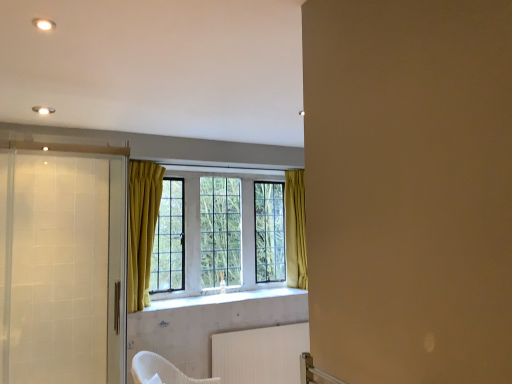
Question: Considering the relative positions of white textured radiator at lower center and white textured tile at center in the image provided, is white textured radiator at lower center to the left or to the right of white textured tile at center?

Choices:
 (A) left
 (B) right

Answer: (B)

Question: Relative to white textured tile at center, is white textured radiator at lower center in front or behind?

Choices:
 (A) behind
 (B) front

Answer: (A)

Question: Estimate the real-world distances between objects in this image. Which object is farther from the clear glass screen door at left, the 2th screen door when ordered from front to back?

Choices:
 (A) white textured tile at center
 (B) white textured armchair at lower center
 (C) translucent glass screen door at left, which is the second screen door from back to front
 (D) white textured radiator at lower center
 (E) clear glass window at center

Answer: (D)

Question: Which of these objects is positioned closest to the clear glass screen door at left, which appears as the 1th screen door when viewed from the back?

Choices:
 (A) white textured radiator at lower center
 (B) white textured tile at center
 (C) translucent glass screen door at left, which is the second screen door from back to front
 (D) white textured armchair at lower center
 (E) clear glass window at center

Answer: (C)